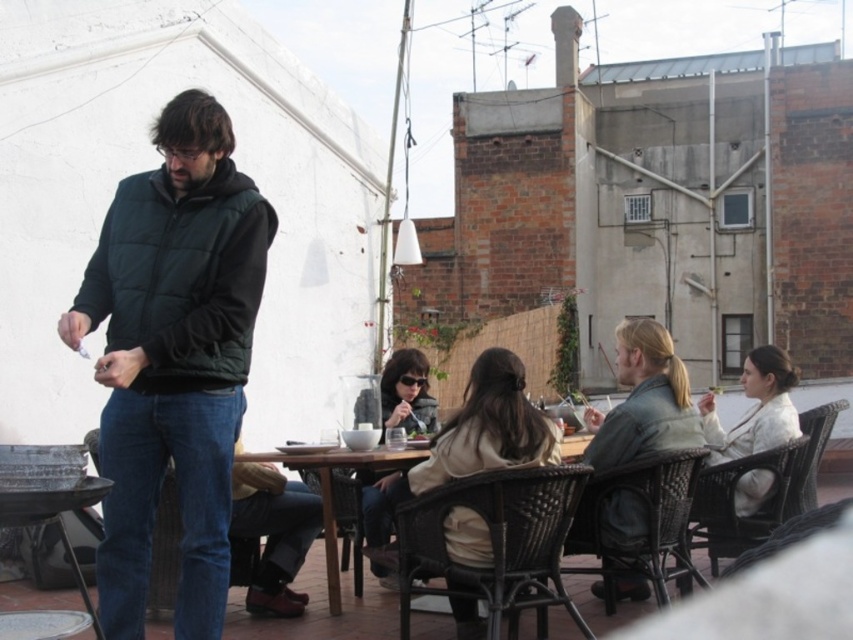
You are standing at the rooftop gathering and want to give a gift to the man in the dark green puffer vest. If you walk straight towards the point at coordinates [728,435], will you reach him?

The point at coordinates [728,435] is 23.84 meters away from the viewer, so walking straight towards it would not reach the man in the dark green puffer vest since the distance is too far.

You are a guest at this rooftop gathering and need to sit down. You see the matte black vest at left and the denim fabric chair at lower left. Which object should you interact with to find a place to sit?

The denim fabric chair at lower left is the object you should interact with to find a place to sit because it is a chair, while the matte black vest at left is clothing worn by a person and cannot be sat on.

You are standing at the edge of the rooftop and want to give a gift to the person wearing the matte black jacket at center. To reach them, you need to walk past the metallic silver grill at lower left. Based on their positions, which direction should you move relative to the grill to get to the jacket?

The matte black jacket at center is to the right of the metallic silver grill at lower left, so you should move to the right of the grill to reach the jacket.